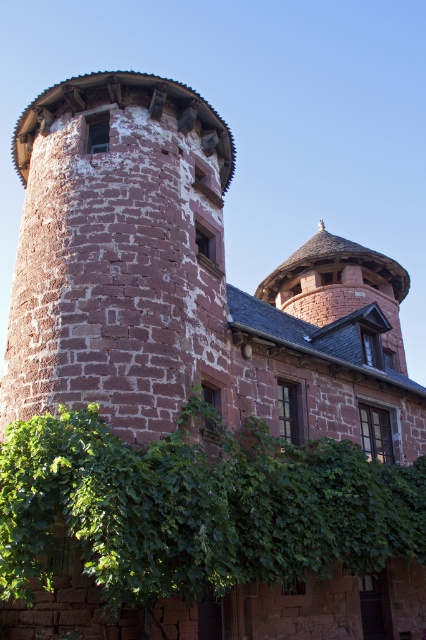
Is brown stone tower at left bigger than green leafy ivy at lower center?

Yes.

Image resolution: width=426 pixels, height=640 pixels. In order to click on brown stone tower at left in this screenshot , I will do point(118,252).